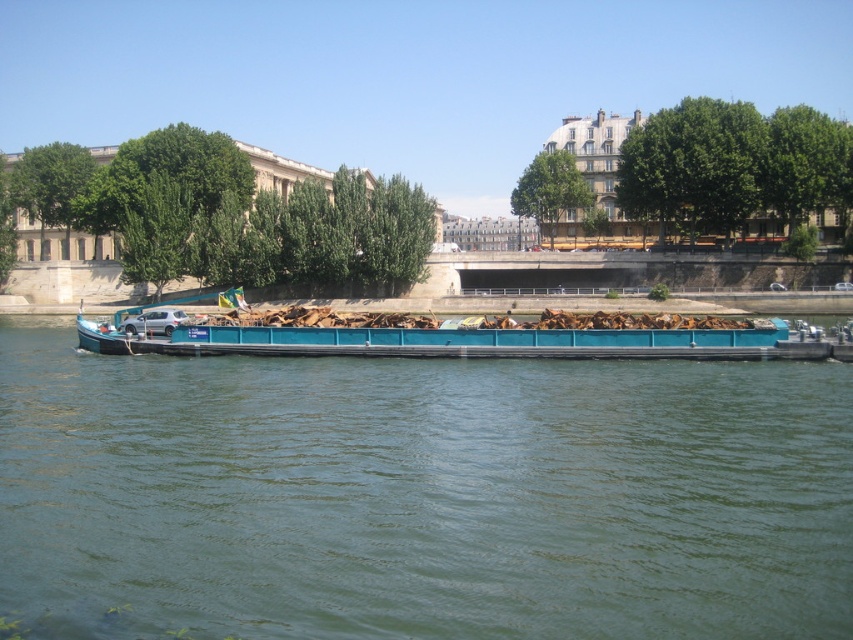
Question: Can you confirm if teal metallic barge at center is smaller than teal matte barge at center?

Choices:
 (A) yes
 (B) no

Answer: (B)

Question: Which of the following is the closest to the observer?

Choices:
 (A) (157, 360)
 (B) (564, 346)

Answer: (B)

Question: Which point appears closest to the camera in this image?

Choices:
 (A) (234, 349)
 (B) (577, 589)

Answer: (B)

Question: Is teal metallic barge at center in front of teal matte barge at center?

Choices:
 (A) no
 (B) yes

Answer: (B)

Question: Does teal metallic barge at center appear under teal matte barge at center?

Choices:
 (A) no
 (B) yes

Answer: (B)